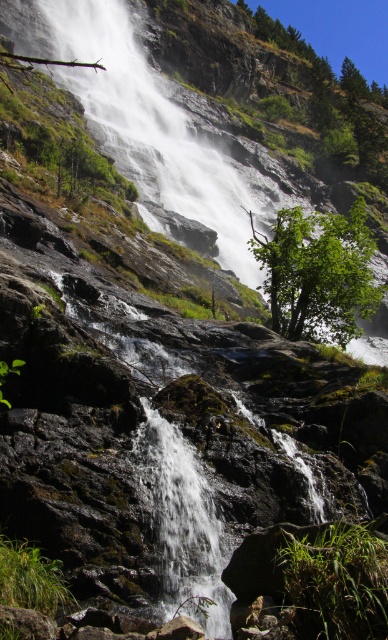
Question: Which of these objects is positioned closest to the white smooth waterfall at center?

Choices:
 (A) clear water at center
 (B) green leafy tree at center

Answer: (B)

Question: Which of the following is the farthest from the observer?

Choices:
 (A) clear water at center
 (B) green leafy tree at center

Answer: (B)

Question: Among these points, which one is farthest from the camera?

Choices:
 (A) (119, 163)
 (B) (157, 492)
 (C) (370, 275)

Answer: (A)

Question: Is green leafy tree at center smaller than clear water at center?

Choices:
 (A) no
 (B) yes

Answer: (A)

Question: In this image, where is green leafy tree at center located relative to clear water at center?

Choices:
 (A) above
 (B) below

Answer: (A)

Question: Is white smooth waterfall at center bigger than clear water at center?

Choices:
 (A) yes
 (B) no

Answer: (A)